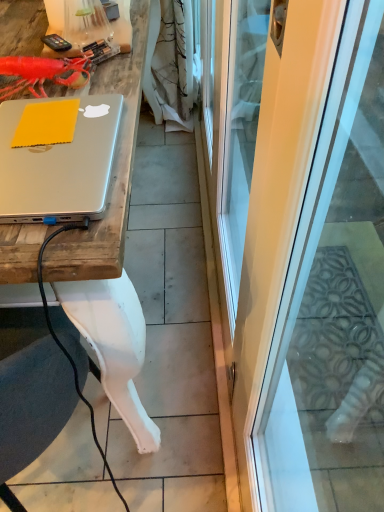
Question: Is silver metallic desk at upper left oriented towards matte silver laptop at upper left?

Choices:
 (A) no
 (B) yes

Answer: (A)

Question: From a real-world perspective, is silver metallic desk at upper left located beneath matte silver laptop at upper left?

Choices:
 (A) yes
 (B) no

Answer: (A)

Question: Is matte silver laptop at upper left completely or partially inside silver metallic desk at upper left?

Choices:
 (A) yes
 (B) no

Answer: (B)

Question: From the image's perspective, would you say silver metallic desk at upper left is positioned over matte silver laptop at upper left?

Choices:
 (A) no
 (B) yes

Answer: (B)

Question: Can you confirm if silver metallic desk at upper left is taller than matte silver laptop at upper left?

Choices:
 (A) no
 (B) yes

Answer: (B)

Question: Is point (271, 180) positioned closer to the camera than point (51, 261)?

Choices:
 (A) closer
 (B) farther

Answer: (B)

Question: In terms of width, does transparent glass screen door at center look wider or thinner when compared to silver metallic desk at upper left?

Choices:
 (A) thin
 (B) wide

Answer: (A)

Question: From their relative heights in the image, would you say transparent glass screen door at center is taller or shorter than silver metallic desk at upper left?

Choices:
 (A) tall
 (B) short

Answer: (A)

Question: Considering the positions of transparent glass screen door at center and silver metallic desk at upper left in the image, is transparent glass screen door at center bigger or smaller than silver metallic desk at upper left?

Choices:
 (A) small
 (B) big

Answer: (B)

Question: Considering the positions of rubberized plastic lobster at upper left and transparent glass screen door at center in the image, is rubberized plastic lobster at upper left bigger or smaller than transparent glass screen door at center?

Choices:
 (A) small
 (B) big

Answer: (A)

Question: Considering the positions of rubberized plastic lobster at upper left and transparent glass screen door at center in the image, is rubberized plastic lobster at upper left taller or shorter than transparent glass screen door at center?

Choices:
 (A) tall
 (B) short

Answer: (B)

Question: Does point (52, 71) appear closer or farther from the camera than point (289, 59)?

Choices:
 (A) closer
 (B) farther

Answer: (B)

Question: From a real-world perspective, relative to transparent glass screen door at center, is rubberized plastic lobster at upper left vertically above or below?

Choices:
 (A) below
 (B) above

Answer: (B)

Question: Based on their positions, is matte silver laptop at upper left located to the left or right of rubberized plastic lobster at upper left?

Choices:
 (A) right
 (B) left

Answer: (A)

Question: Is matte silver laptop at upper left bigger or smaller than rubberized plastic lobster at upper left?

Choices:
 (A) small
 (B) big

Answer: (B)